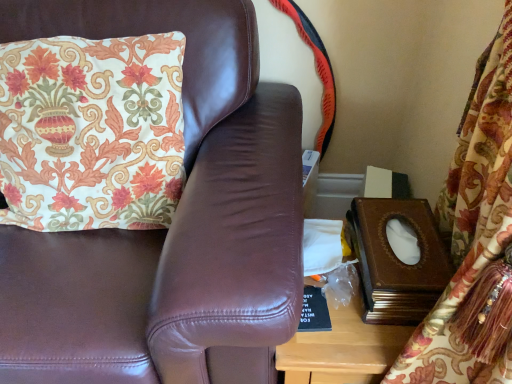
What do you see at coordinates (172, 226) in the screenshot?
I see `brown leather couch at upper left` at bounding box center [172, 226].

Find the location of a particular element. This screenshot has height=384, width=512. brown leather couch at upper left is located at coordinates [172, 226].

This screenshot has height=384, width=512. What do you see at coordinates (91, 132) in the screenshot?
I see `floral fabric cushion at upper left` at bounding box center [91, 132].

At what (x,y) coordinates should I click in order to perform the action: click on floral fabric cushion at upper left. Please return your answer as a coordinate pair (x, y). The height and width of the screenshot is (384, 512). Looking at the image, I should click on (91, 132).

The image size is (512, 384). What are the coordinates of `brown leather couch at upper left` in the screenshot? It's located at (172, 226).

Would you say brown leather couch at upper left is to the left or to the right of floral fabric cushion at upper left in the picture?

brown leather couch at upper left is positioned on floral fabric cushion at upper left's left side.

In the scene shown: Which object is further away from the camera, brown leather couch at upper left or floral fabric cushion at upper left?

floral fabric cushion at upper left is further from the camera.

Is point (116, 319) closer to viewer compared to point (95, 119)?

Yes, it is in front of point (95, 119).

From the image's perspective, which one is positioned higher, brown leather couch at upper left or floral fabric cushion at upper left?

floral fabric cushion at upper left.

From a real-world perspective, is brown leather couch at upper left positioned above or below floral fabric cushion at upper left?

Clearly, from a real-world perspective, brown leather couch at upper left is below floral fabric cushion at upper left.

Which of these two, brown leather couch at upper left or floral fabric cushion at upper left, is thinner?

With smaller width is floral fabric cushion at upper left.

Can you confirm if brown leather couch at upper left is shorter than floral fabric cushion at upper left?

No, brown leather couch at upper left is not shorter than floral fabric cushion at upper left.

Considering the relative sizes of brown leather couch at upper left and floral fabric cushion at upper left in the image provided, is brown leather couch at upper left bigger than floral fabric cushion at upper left?

Yes, brown leather couch at upper left is bigger than floral fabric cushion at upper left.

Would you say brown leather couch at upper left is outside floral fabric cushion at upper left?

brown leather couch at upper left lies outside floral fabric cushion at upper left's area.

Is brown leather couch at upper left directly adjacent to floral fabric cushion at upper left?

No, brown leather couch at upper left is not making contact with floral fabric cushion at upper left.

In the scene shown: Is brown leather couch at upper left looking in the opposite direction of floral fabric cushion at upper left?

That's right, brown leather couch at upper left is facing away from floral fabric cushion at upper left.

How different are the orientations of brown leather couch at upper left and floral fabric cushion at upper left in degrees?

The angle between the facing direction of brown leather couch at upper left and the facing direction of floral fabric cushion at upper left is 2.31 degrees.

Measure the distance from brown leather couch at upper left to floral fabric cushion at upper left.

brown leather couch at upper left is 6.87 inches from floral fabric cushion at upper left.

Identify the location of pillow lying on the right of brown leather couch at upper left. (91, 132).

Is floral fabric cushion at upper left at the right side of brown leather couch at upper left?

Correct, you'll find floral fabric cushion at upper left to the right of brown leather couch at upper left.

Considering their positions, is floral fabric cushion at upper left located in front of or behind brown leather couch at upper left?

In the image, floral fabric cushion at upper left appears behind brown leather couch at upper left.

Considering the positions of points (170, 45) and (134, 331), is point (170, 45) farther from camera compared to point (134, 331)?

Yes, point (170, 45) is farther from viewer.

From the image's perspective, which is above, floral fabric cushion at upper left or brown leather couch at upper left?

floral fabric cushion at upper left, from the image's perspective.

From a real-world perspective, is floral fabric cushion at upper left positioned above or below brown leather couch at upper left?

floral fabric cushion at upper left is situated higher than brown leather couch at upper left in the real world.

Considering the sizes of objects floral fabric cushion at upper left and brown leather couch at upper left in the image provided, who is thinner, floral fabric cushion at upper left or brown leather couch at upper left?

Thinner between the two is floral fabric cushion at upper left.

Who is taller, floral fabric cushion at upper left or brown leather couch at upper left?

With more height is brown leather couch at upper left.

Considering the sizes of objects floral fabric cushion at upper left and brown leather couch at upper left in the image provided, who is bigger, floral fabric cushion at upper left or brown leather couch at upper left?

brown leather couch at upper left is bigger.

Is floral fabric cushion at upper left spatially inside brown leather couch at upper left, or outside of it?

The correct answer is: inside.

From the picture: Is floral fabric cushion at upper left beside brown leather couch at upper left?

No, floral fabric cushion at upper left is not in contact with brown leather couch at upper left.

Is floral fabric cushion at upper left facing towards brown leather couch at upper left?

Yes, floral fabric cushion at upper left is turned towards brown leather couch at upper left.

From the picture: How far apart are floral fabric cushion at upper left and brown leather couch at upper left?

6.87 inches.

The width and height of the screenshot is (512, 384). Find the location of `pillow lying behind the brown leather couch at upper left`. pillow lying behind the brown leather couch at upper left is located at coordinates (91, 132).

Where is `furniture in front of the floral fabric cushion at upper left`? The height and width of the screenshot is (384, 512). furniture in front of the floral fabric cushion at upper left is located at coordinates (172, 226).

Identify the location of pillow that appears on the right of brown leather couch at upper left. (91, 132).